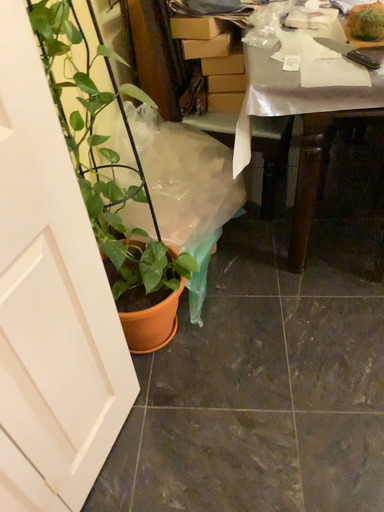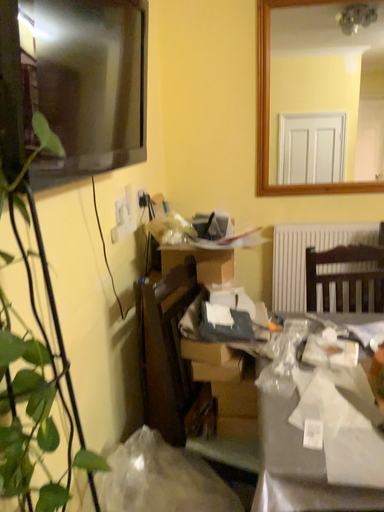
Question: Which way did the camera rotate in the video?

Choices:
 (A) rotated upward
 (B) rotated downward

Answer: (A)